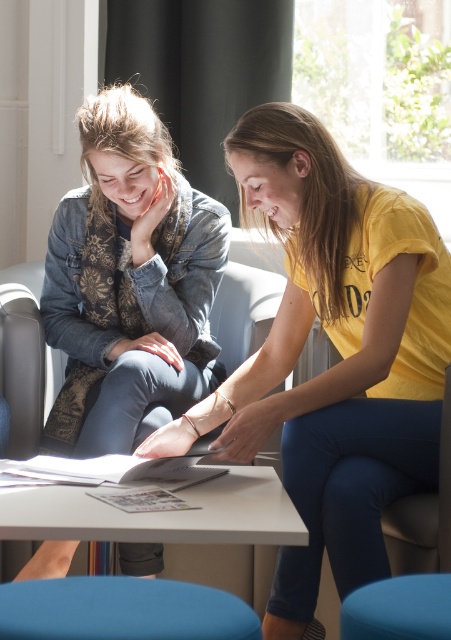
Question: Can you confirm if blue fabric stool at lower center is positioned to the left of teal fabric stool at lower center?

Choices:
 (A) no
 (B) yes

Answer: (B)

Question: Can you confirm if yellow matte t-shirt at center is smaller than white glossy table at center?

Choices:
 (A) no
 (B) yes

Answer: (A)

Question: Estimate the real-world distances between objects in this image. Which object is farther from the white glossy table at center?

Choices:
 (A) teal fabric stool at lower center
 (B) denim jacket at upper left
 (C) blue fabric stool at lower center

Answer: (B)

Question: Which object appears farthest from the camera in this image?

Choices:
 (A) white glossy table at center
 (B) teal fabric stool at lower center

Answer: (A)

Question: Does yellow matte t-shirt at center have a greater width compared to blue fabric stool at lower center?

Choices:
 (A) no
 (B) yes

Answer: (B)

Question: Among these points, which one is farthest from the camera?

Choices:
 (A) (132, 592)
 (B) (61, 317)

Answer: (B)